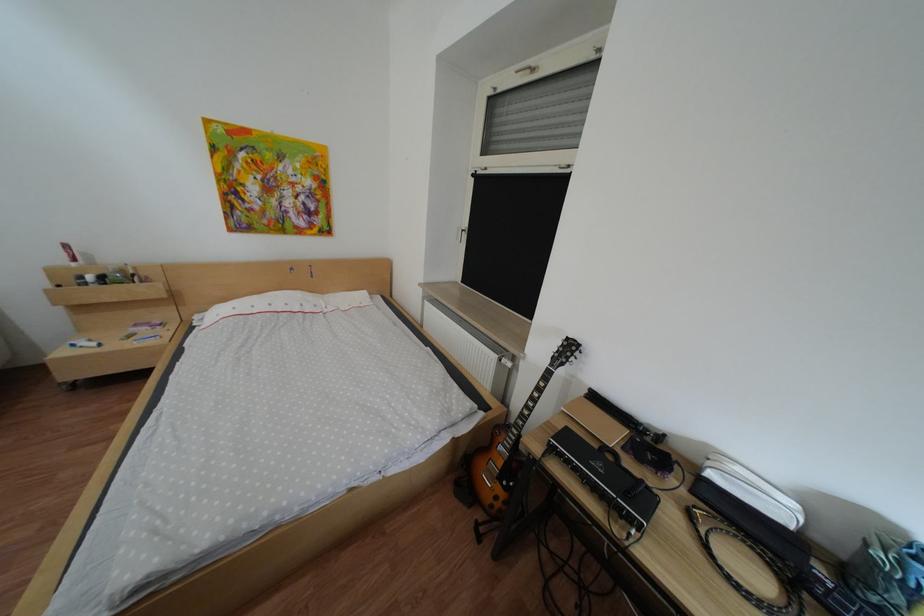
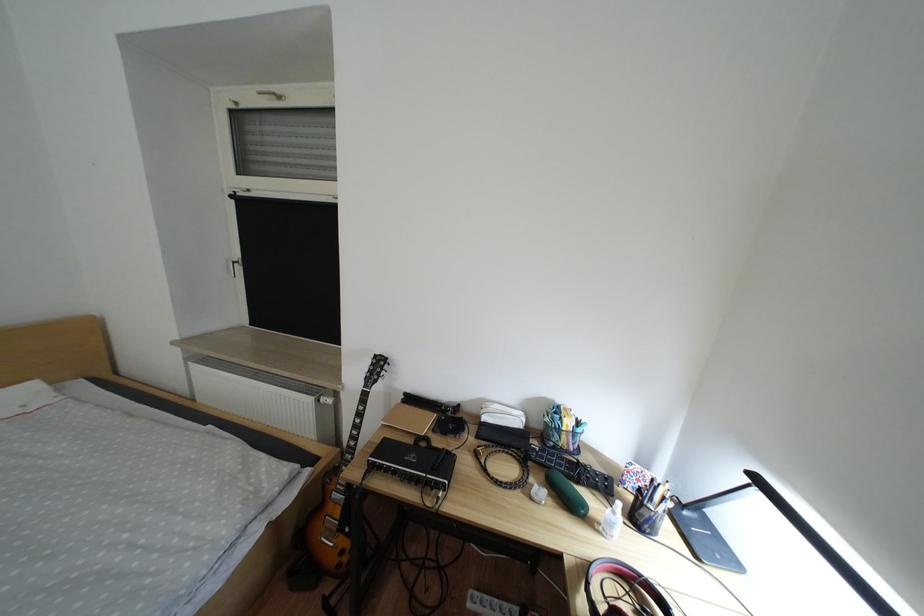
In the second image, find the point that corresponds to point 538,365 in the first image.

(359, 397)